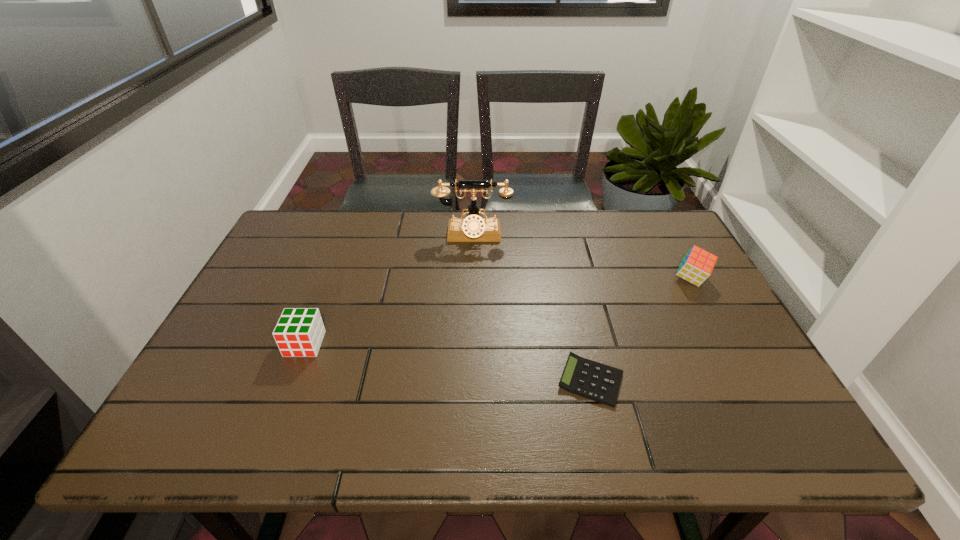
Image resolution: width=960 pixels, height=540 pixels. I want to click on telephone, so click(x=473, y=228).

Where is `the farthest object`? the farthest object is located at coordinates (473, 228).

At what (x,y) coordinates should I click in order to perform the action: click on the second farthest object. Please return your answer as a coordinate pair (x, y). The image size is (960, 540). Looking at the image, I should click on (697, 265).

The width and height of the screenshot is (960, 540). In order to click on the right cube in this screenshot , I will do (697, 265).

The image size is (960, 540). I want to click on the second shortest object, so click(x=299, y=332).

Identify the location of the shorter cube. (299, 332).

Image resolution: width=960 pixels, height=540 pixels. Find the location of `calculator`. calculator is located at coordinates (589, 379).

You are a GUI agent. You are given a task and a screenshot of the screen. Output one action in this format:
    pyautogui.click(x=<x>, y=<y>)
    Task: Click on the third object from left to right
    This screenshot has width=960, height=540.
    Given the screenshot: What is the action you would take?
    pyautogui.click(x=589, y=379)

Find the location of a particular element. This screenshot has width=960, height=540. blank area located on the dial of the farthest object is located at coordinates (471, 296).

Find the location of a particular element. Image resolution: width=960 pixels, height=540 pixels. blank area located on the back of the rightmost object is located at coordinates (671, 242).